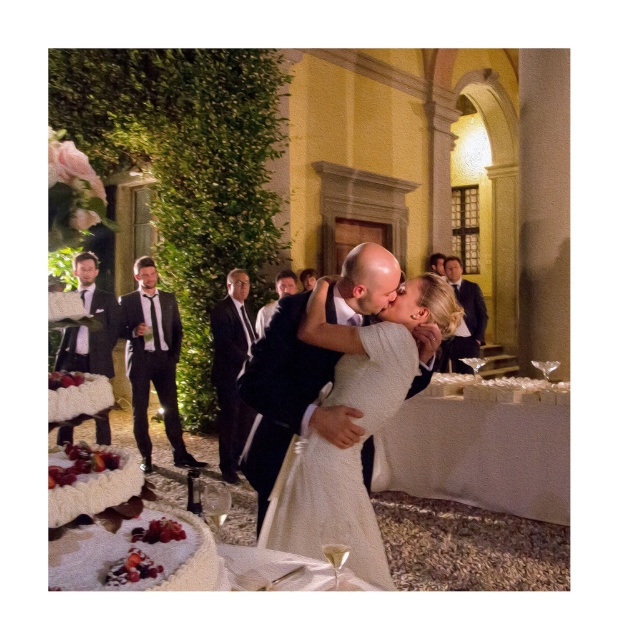
Question: Which object appears closest to the camera in this image?

Choices:
 (A) shiny black suit at left
 (B) matte black suit at upper right
 (C) dark suit at center
 (D) white textured cake at lower left

Answer: (D)

Question: Can you confirm if shiny black suit at left is wider than matte black suit at upper right?

Choices:
 (A) yes
 (B) no

Answer: (B)

Question: Which point appears closest to the camera in this image?

Choices:
 (A) (171, 451)
 (B) (275, 289)
 (C) (82, 529)
 (D) (64, 369)

Answer: (C)

Question: Is white satin cake at lower left thinner than matte black suit at upper right?

Choices:
 (A) yes
 (B) no

Answer: (B)

Question: Which object is the farthest from the dark suit at center?

Choices:
 (A) black textured suit at left
 (B) shiny black suit at left

Answer: (B)

Question: Can you confirm if black textured suit at left is positioned to the left of dark suit at center?

Choices:
 (A) yes
 (B) no

Answer: (A)